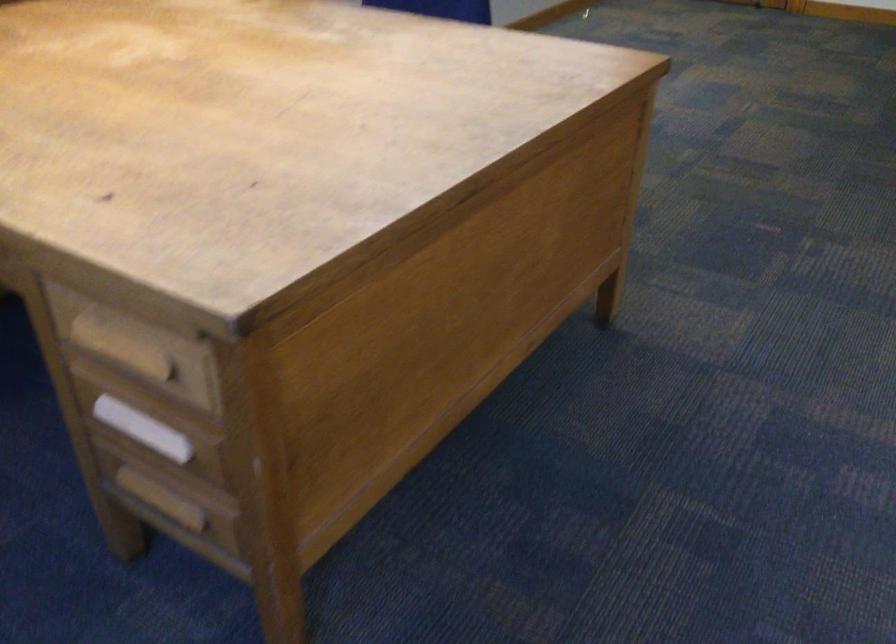
The images are taken continuously from a first-person perspective. In which direction is your viewpoint rotating?

The rotation direction of the camera is right-down.